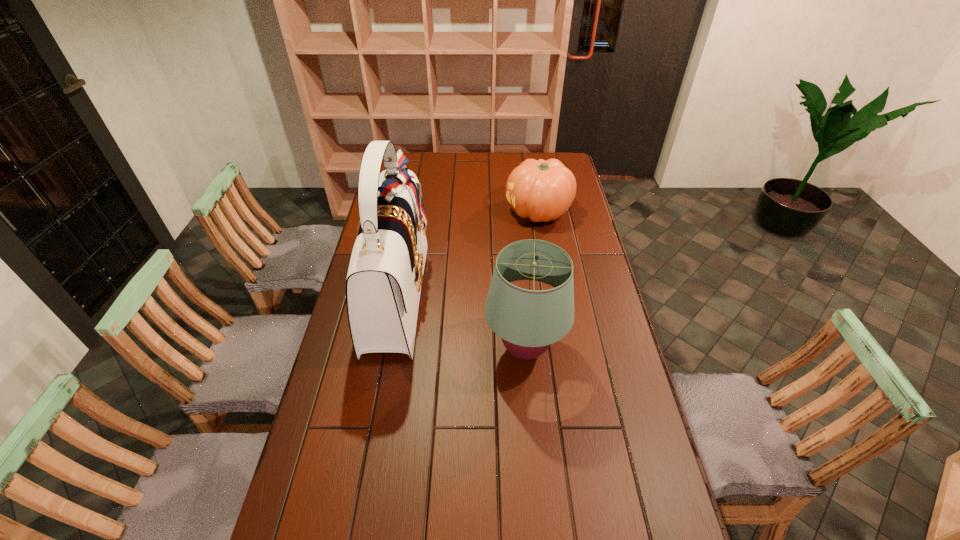
Image resolution: width=960 pixels, height=540 pixels. Identify the location of object that is at the left edge. (385, 275).

Locate an element on the screen. object that is at the right edge is located at coordinates (540, 190).

In the image, there is a desktop. At what (x,y) coordinates should I click in order to perform the action: click on vacant space at the far edge. Please return your answer as a coordinate pair (x, y). This screenshot has width=960, height=540. Looking at the image, I should click on (491, 176).

The width and height of the screenshot is (960, 540). In order to click on free spot at the left edge of the desktop in this screenshot , I will do `click(341, 390)`.

Where is `free space at the right edge of the desktop`? free space at the right edge of the desktop is located at coordinates pos(589,437).

At what (x,y) coordinates should I click in order to perform the action: click on free space at the far right corner of the desktop. Please return your answer as a coordinate pair (x, y). Looking at the image, I should click on (549, 153).

This screenshot has width=960, height=540. In order to click on vacant space that's between the leftmost object and the second shortest object in this screenshot , I will do `click(461, 321)`.

The width and height of the screenshot is (960, 540). What are the coordinates of `free space between the lampshade and the pumpkin` in the screenshot? It's located at (532, 280).

The height and width of the screenshot is (540, 960). Find the location of `vacant area that lies between the shortest object and the satchel`. vacant area that lies between the shortest object and the satchel is located at coordinates (468, 253).

This screenshot has width=960, height=540. Find the location of `vacant space that is in between the second shortest object and the tallest object`. vacant space that is in between the second shortest object and the tallest object is located at coordinates click(x=461, y=321).